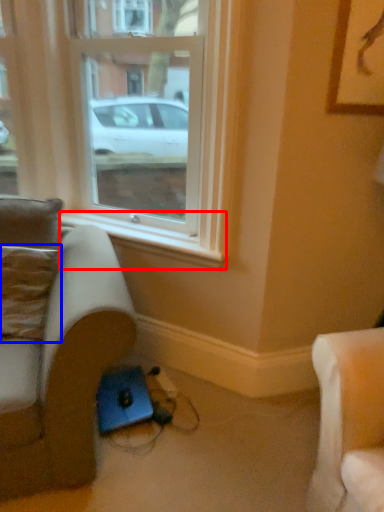
Question: Which of the following is the farthest to the observer, window sill (highlighted by a red box) or pillow (highlighted by a blue box)?

Choices:
 (A) window sill
 (B) pillow

Answer: (A)